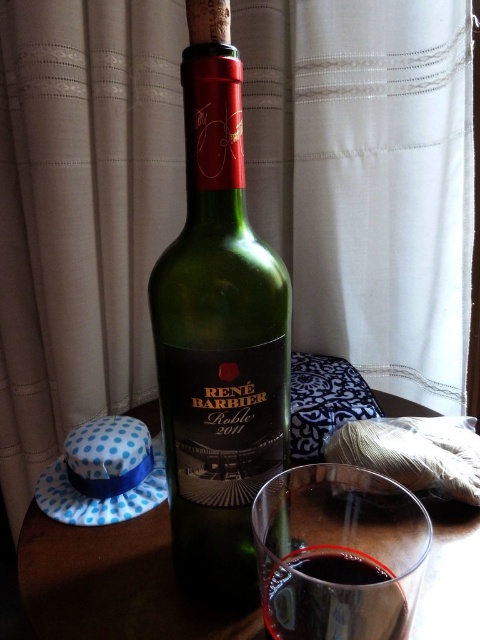
Which is behind, point (273, 464) or point (372, 612)?

Point (273, 464)

Which is more to the right, green glass bottle at center or dark red liquid at center?

From the viewer's perspective, dark red liquid at center appears more on the right side.

Which is behind, point (227, 273) or point (265, 604)?

The point (265, 604) is more distant.

Identify the location of green glass bottle at center. (218, 332).

Is brown wooden table at center wider than dark red liquid at center?

Indeed, brown wooden table at center has a greater width compared to dark red liquid at center.

Is brown wooden table at center to the right of dark red liquid at center from the viewer's perspective?

Incorrect, brown wooden table at center is not on the right side of dark red liquid at center.

This screenshot has height=640, width=480. I want to click on brown wooden table at center, so click(x=112, y=582).

Find the location of a particular element. brown wooden table at center is located at coordinates (112, 582).

Describe the element at coordinates (337, 554) in the screenshot. I see `transparent glass at center` at that location.

Who is higher up, transparent glass at center or dark red liquid at center?

transparent glass at center

The width and height of the screenshot is (480, 640). Find the location of `transparent glass at center`. transparent glass at center is located at coordinates (337, 554).